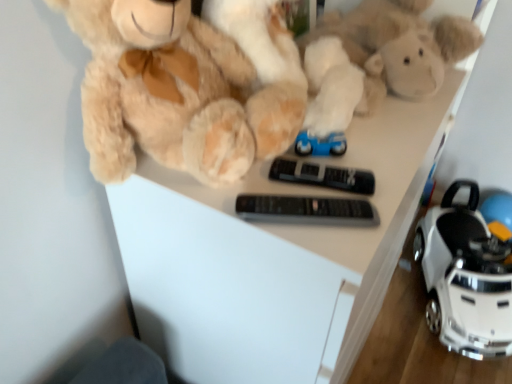
Question: Can white plastic toy car at lower right be found inside black plastic remote at center, acting as the second control starting from the front?

Choices:
 (A) no
 (B) yes

Answer: (A)

Question: Could you tell me if black plastic remote at center, acting as the second control starting from the front, is facing white plastic toy car at lower right?

Choices:
 (A) yes
 (B) no

Answer: (B)

Question: From a real-world perspective, is black plastic remote at center, the first control in the back-to-front sequence, positioned under white plastic toy car at lower right based on gravity?

Choices:
 (A) yes
 (B) no

Answer: (B)

Question: Considering the relative positions of black plastic remote at center, the first control in the back-to-front sequence, and white plastic toy car at lower right in the image provided, is black plastic remote at center, the first control in the back-to-front sequence, behind white plastic toy car at lower right?

Choices:
 (A) no
 (B) yes

Answer: (A)

Question: From the image's perspective, is black plastic remote at center, acting as the second control starting from the front, over white plastic toy car at lower right?

Choices:
 (A) no
 (B) yes

Answer: (B)

Question: Would you say white plastic toy car at lower right is to the left or to the right of black plastic remote at center, which is the 1th control from front to back, in the picture?

Choices:
 (A) right
 (B) left

Answer: (A)

Question: From a real-world perspective, relative to black plastic remote at center, placed as the second control when sorted from back to front, is white plastic toy car at lower right vertically above or below?

Choices:
 (A) above
 (B) below

Answer: (B)

Question: Considering the positions of white plastic toy car at lower right and black plastic remote at center, placed as the second control when sorted from back to front, in the image, is white plastic toy car at lower right taller or shorter than black plastic remote at center, placed as the second control when sorted from back to front,?

Choices:
 (A) short
 (B) tall

Answer: (B)

Question: Relative to black plastic remote at center, placed as the second control when sorted from back to front, is white plastic toy car at lower right in front or behind?

Choices:
 (A) behind
 (B) front

Answer: (A)

Question: In terms of height, does white plastic toy car at lower right look taller or shorter compared to soft plush toy at center?

Choices:
 (A) short
 (B) tall

Answer: (B)

Question: In the image, is white plastic toy car at lower right on the left side or the right side of soft plush toy at center?

Choices:
 (A) left
 (B) right

Answer: (B)

Question: Is white plastic toy car at lower right in front of or behind soft plush toy at center in the image?

Choices:
 (A) front
 (B) behind

Answer: (B)

Question: From the image's perspective, is white plastic toy car at lower right above or below soft plush toy at center?

Choices:
 (A) below
 (B) above

Answer: (A)

Question: Is fluffy beige teddy bear at upper left in front of or behind white plastic toy car at lower right in the image?

Choices:
 (A) front
 (B) behind

Answer: (A)

Question: Visually, is fluffy beige teddy bear at upper left positioned to the left or to the right of white plastic toy car at lower right?

Choices:
 (A) left
 (B) right

Answer: (A)